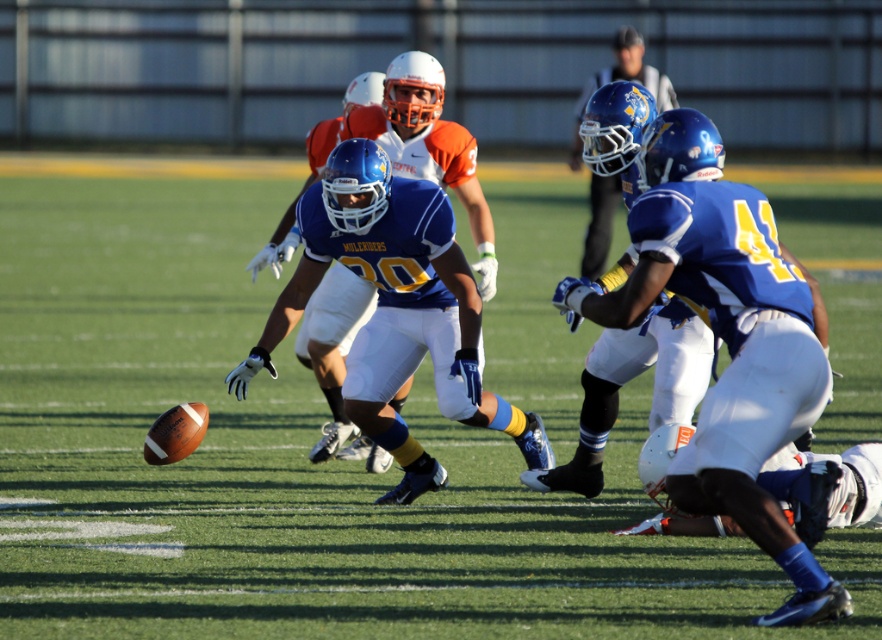
You are a sports analyst watching the football game. You notice the matte blue jersey at center and the blue matte helmet at upper center. Which object is positioned more to the left in the image?

The matte blue jersey at center is positioned to the left of the blue matte helmet at upper center, so the matte blue jersey at center is more to the left.

You are a football coach observing the game. You notice the blue matte uniform at center and the blue matte helmet at upper center. Which object appears taller in the image?

The blue matte helmet at upper center appears taller than the blue matte uniform at center.